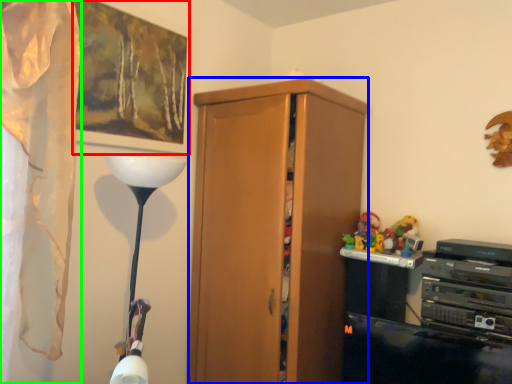
Question: Which is farther away from picture frame (highlighted by a red box)? cabinetry (highlighted by a blue box) or curtain (highlighted by a green box)?

Choices:
 (A) cabinetry
 (B) curtain

Answer: (A)